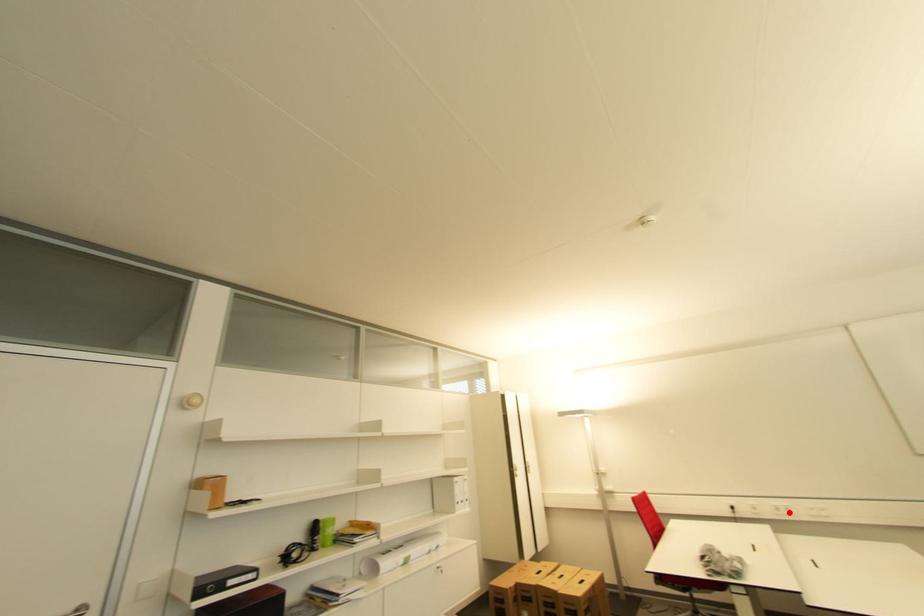
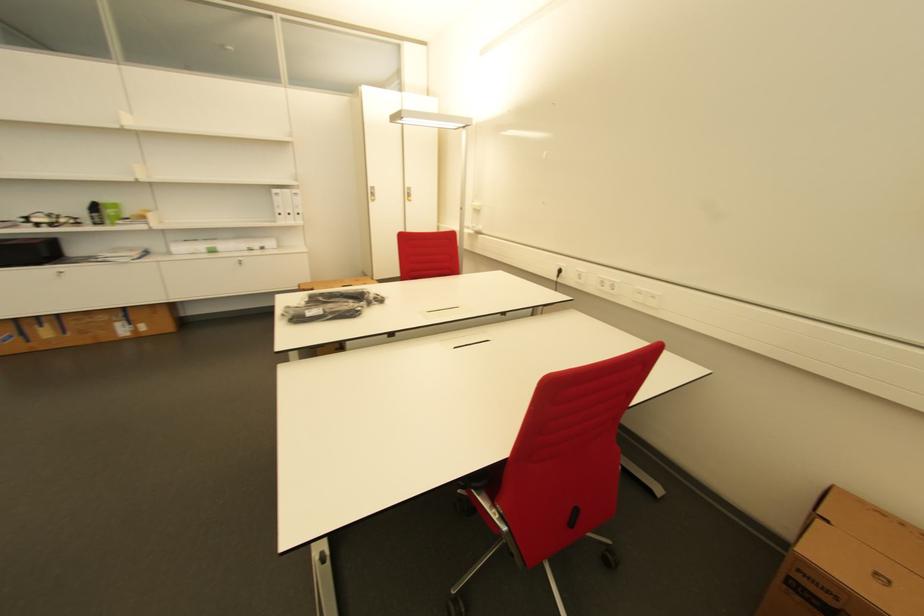
Where in the second image is the point corresponding to the highlighted location from the first image?

(612, 289)